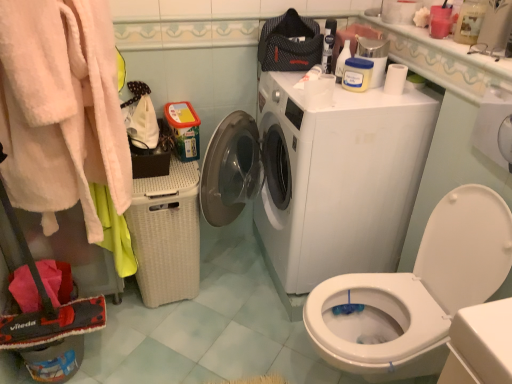
What do you see at coordinates (319, 92) in the screenshot? I see `white matte toilet paper at upper right, which is the first toilet paper in front-to-back order` at bounding box center [319, 92].

Describe the element at coordinates (342, 61) in the screenshot. This screenshot has width=512, height=384. I see `matte white jar at upper center` at that location.

What is the approximate width of white glossy washing machine at center?

37.27 inches.

Where is `white glossy toilet at lower right`? The image size is (512, 384). white glossy toilet at lower right is located at coordinates (416, 292).

What do you see at coordinates (416, 292) in the screenshot?
I see `white glossy toilet at lower right` at bounding box center [416, 292].

Describe the element at coordinates (444, 60) in the screenshot. The height and width of the screenshot is (384, 512). I see `white glossy countertop at upper right` at that location.

The image size is (512, 384). Identify the location of white wicker laundry basket at left. (166, 234).

The height and width of the screenshot is (384, 512). What do you see at coordinates (166, 234) in the screenshot? I see `white wicker laundry basket at left` at bounding box center [166, 234].

This screenshot has width=512, height=384. Identify the location of white matte toilet paper at upper right, placed as the 1th toilet paper when sorted from back to front. (395, 79).

Is white matte toilet paper at upper right, arranged as the 2th toilet paper when viewed from the back, looking in the opposite direction of white glossy washing machine at center?

That's not correct — white matte toilet paper at upper right, arranged as the 2th toilet paper when viewed from the back, is not looking away from white glossy washing machine at center.

From the image's perspective, between white matte toilet paper at upper right, which is the first toilet paper in front-to-back order, and white glossy washing machine at center, who is located below?

white glossy washing machine at center, from the image's perspective.

Does white matte toilet paper at upper right, acting as the second toilet paper starting from the right, have a greater height compared to white glossy washing machine at center?

No, white matte toilet paper at upper right, acting as the second toilet paper starting from the right, is not taller than white glossy washing machine at center.

Is the surface of white matte toilet paper at upper right, acting as the second toilet paper starting from the right, in direct contact with white glossy washing machine at center?

They are not placed beside each other.

Is white glossy toilet at lower right spatially inside white glossy countertop at upper right, or outside of it?

white glossy toilet at lower right cannot be found inside white glossy countertop at upper right.

Is white glossy countertop at upper right at the back of white glossy toilet at lower right?

That's not correct — white glossy toilet at lower right is not looking away from white glossy countertop at upper right.

From the image's perspective, is white glossy toilet at lower right on white glossy countertop at upper right?

Incorrect, from the image's perspective, white glossy toilet at lower right is lower than white glossy countertop at upper right.

Looking at this image, is white glossy toilet at lower right to the left of white glossy countertop at upper right from the viewer's perspective?

Yes.

Is fluffy pink bathrobe at left touching white glossy countertop at upper right?

fluffy pink bathrobe at left and white glossy countertop at upper right are not in contact.

Who is more distant, fluffy pink bathrobe at left or white glossy countertop at upper right?

Positioned behind is white glossy countertop at upper right.

In the scene shown: Considering the relative sizes of fluffy pink bathrobe at left and white glossy countertop at upper right in the image provided, is fluffy pink bathrobe at left wider than white glossy countertop at upper right?

Yes, fluffy pink bathrobe at left is wider than white glossy countertop at upper right.

From the image's perspective, between fluffy pink bathrobe at left and white glossy countertop at upper right, who is located below?

fluffy pink bathrobe at left appears lower in the image.

Is matte white jar at upper center beside white glossy countertop at upper right?

No.

Looking at this image, considering the relative positions of matte white jar at upper center and white glossy countertop at upper right in the image provided, is matte white jar at upper center to the left or to the right of white glossy countertop at upper right?

Based on their positions, matte white jar at upper center is located to the left of white glossy countertop at upper right.

In terms of height, does matte white jar at upper center look taller or shorter compared to white glossy countertop at upper right?

Considering their sizes, matte white jar at upper center has more height than white glossy countertop at upper right.

From a real-world perspective, does matte white jar at upper center stand above white glossy countertop at upper right?

No, from a real-world perspective, matte white jar at upper center is not above white glossy countertop at upper right.

Which is correct: matte white jar at upper center is inside white glossy washing machine at center, or outside of it?

matte white jar at upper center is spatially situated outside white glossy washing machine at center.

Is matte white jar at upper center not close to white glossy washing machine at center?

Actually, matte white jar at upper center and white glossy washing machine at center are a little close together.

Which is in front, point (342, 59) or point (394, 156)?

The point (394, 156) is closer to the camera.

Between matte white jar at upper center and white glossy washing machine at center, which one has less height?

matte white jar at upper center.

Which is closer to the camera, (342, 64) or (431, 244)?

The point (431, 244) is closer to the camera.

Which object is positioned more to the left, matte white jar at upper center or white glossy toilet at lower right?

Positioned to the left is matte white jar at upper center.

Based on the photo, can we say matte white jar at upper center lies outside white glossy toilet at lower right?

Yes, matte white jar at upper center is outside of white glossy toilet at lower right.

Is matte white jar at upper center directly adjacent to white glossy toilet at lower right?

No, matte white jar at upper center is not next to white glossy toilet at lower right.

From the image's perspective, is white matte toilet paper at upper right, placed as the 1th toilet paper when sorted from back to front, below white glossy countertop at upper right?

Correct, white matte toilet paper at upper right, placed as the 1th toilet paper when sorted from back to front, appears lower than white glossy countertop at upper right in the image.

Between white matte toilet paper at upper right, arranged as the second toilet paper when viewed from the front, and white glossy countertop at upper right, which one has larger width?

With larger width is white matte toilet paper at upper right, arranged as the second toilet paper when viewed from the front.

What are the coordinates of `the 1st toilet paper below the white glossy countertop at upper right (from the image's perspective)` in the screenshot? It's located at (395, 79).

Where is `toilet paper that is the 1st object located behind the white glossy washing machine at center`? toilet paper that is the 1st object located behind the white glossy washing machine at center is located at coordinates (319, 92).

Where is `counter top that is above the white glossy toilet at lower right (from a real-world perspective)`? Image resolution: width=512 pixels, height=384 pixels. counter top that is above the white glossy toilet at lower right (from a real-world perspective) is located at coordinates (444, 60).

Looking at the image, which one is located further to white matte toilet paper at upper right, which appears as the 1th toilet paper when viewed from the left, matte white jar at upper center or white matte toilet paper at upper right, marked as the first toilet paper in a right-to-left arrangement?

Among the two, white matte toilet paper at upper right, marked as the first toilet paper in a right-to-left arrangement, is located further to white matte toilet paper at upper right, which appears as the 1th toilet paper when viewed from the left.

Looking at the image, which one is located further to white glossy washing machine at center, white matte toilet paper at upper right, which appears as the 1th toilet paper when viewed from the left, or matte white jar at upper center?

Among the two, matte white jar at upper center is located further to white glossy washing machine at center.

Looking at the image, which one is located closer to matte white jar at upper center, white wicker laundry basket at left or white glossy washing machine at center?

white glossy washing machine at center is closer to matte white jar at upper center.

Which object lies nearer to the anchor point white wicker laundry basket at left, white matte toilet paper at upper right, marked as the 2th toilet paper in a left-to-right arrangement, or white glossy countertop at upper right?

white matte toilet paper at upper right, marked as the 2th toilet paper in a left-to-right arrangement, is positioned closer to the anchor white wicker laundry basket at left.

Estimate the real-world distances between objects in this image. Which object is further from white glossy toilet at lower right, white glossy washing machine at center or white matte toilet paper at upper right, marked as the 2th toilet paper in a left-to-right arrangement?

Based on the image, white matte toilet paper at upper right, marked as the 2th toilet paper in a left-to-right arrangement, appears to be further to white glossy toilet at lower right.

Considering their positions, is matte white jar at upper center positioned closer to white glossy toilet at lower right than white matte toilet paper at upper right, arranged as the second toilet paper when viewed from the front?

white matte toilet paper at upper right, arranged as the second toilet paper when viewed from the front, is closer to white glossy toilet at lower right.

Looking at the image, which one is located further to white glossy washing machine at center, fluffy pink bathrobe at left or white matte toilet paper at upper right, placed as the 1th toilet paper when sorted from back to front?

Based on the image, fluffy pink bathrobe at left appears to be further to white glossy washing machine at center.

Looking at the image, which one is located closer to white glossy countertop at upper right, fluffy pink bathrobe at left or white matte toilet paper at upper right, arranged as the 2th toilet paper when viewed from the back?

white matte toilet paper at upper right, arranged as the 2th toilet paper when viewed from the back, lies closer to white glossy countertop at upper right than the other object.

Locate an element on the screen. washing machine between matte white jar at upper center and white glossy toilet at lower right vertically is located at coordinates (337, 178).

At what (x,y) coordinates should I click in order to perform the action: click on sit between fluffy pink bathrobe at left and white glossy countertop at upper right. Please return your answer as a coordinate pair (x, y). This screenshot has width=512, height=384. Looking at the image, I should click on (416, 292).

What are the coordinates of `washing machine between fluffy pink bathrobe at left and white matte toilet paper at upper right, arranged as the second toilet paper when viewed from the front, in the horizontal direction` in the screenshot? It's located at (337, 178).

Identify the location of sit situated between white wicker laundry basket at left and white glossy countertop at upper right from left to right. The image size is (512, 384). (416, 292).